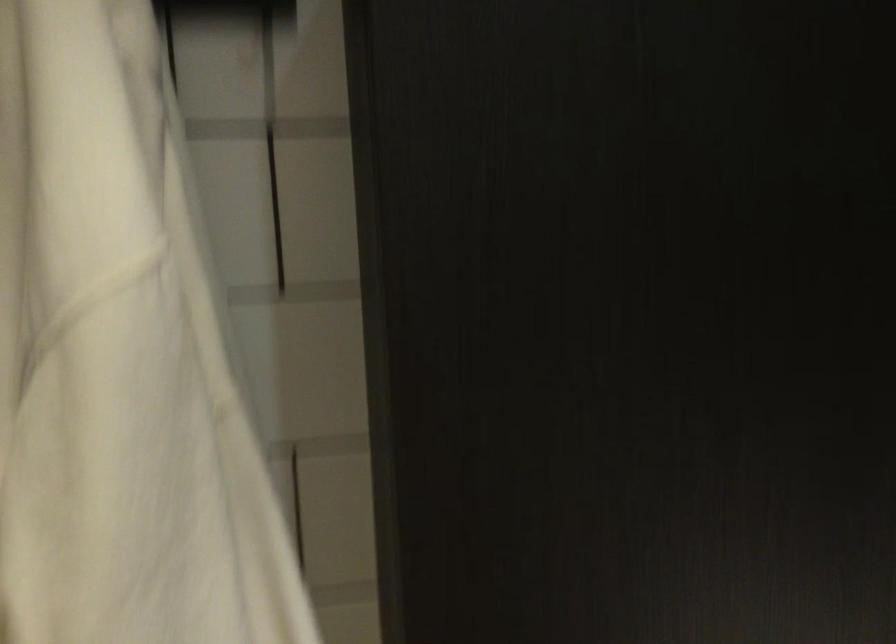
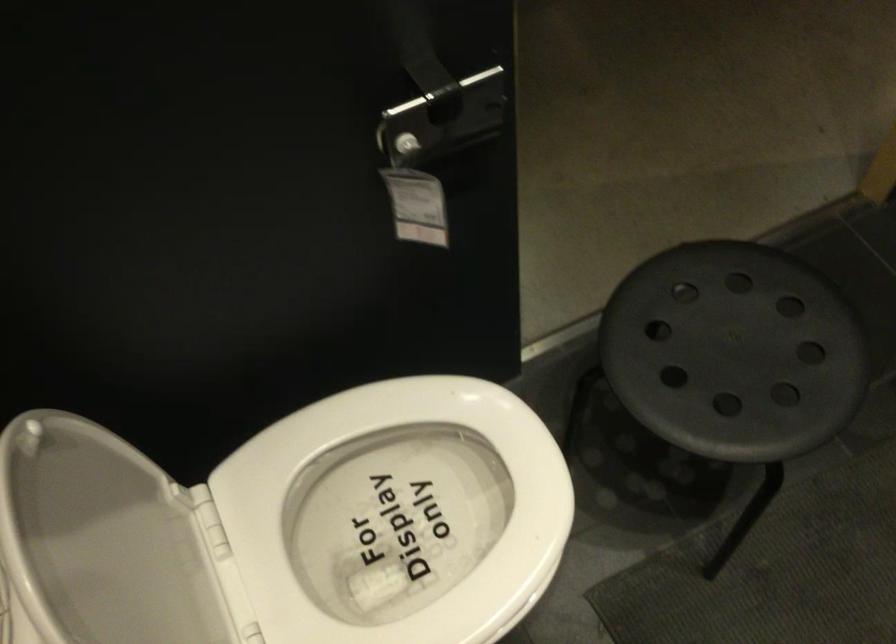
How did the camera likely rotate?

The camera's rotation is toward left-down.